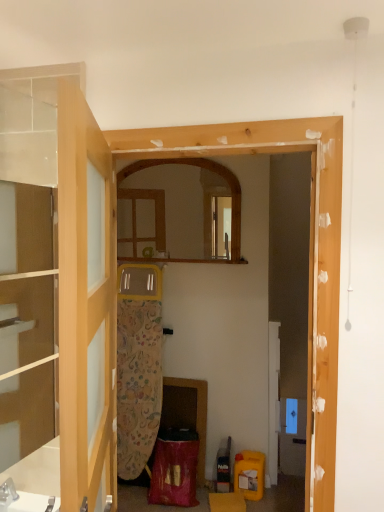
Question: From the image's perspective, is clear glass door at left above transparent glass cabinet at left?

Choices:
 (A) yes
 (B) no

Answer: (B)

Question: Is the position of clear glass door at left less distant than that of transparent glass cabinet at left?

Choices:
 (A) yes
 (B) no

Answer: (A)

Question: Does clear glass door at left come behind transparent glass cabinet at left?

Choices:
 (A) yes
 (B) no

Answer: (B)

Question: Is clear glass door at left positioned far away from transparent glass cabinet at left?

Choices:
 (A) yes
 (B) no

Answer: (B)

Question: Is clear glass door at left at the right side of transparent glass cabinet at left?

Choices:
 (A) no
 (B) yes

Answer: (B)

Question: Would you say clear glass door at left is inside or outside transparent glass cabinet at left?

Choices:
 (A) inside
 (B) outside

Answer: (B)

Question: Considering the positions of clear glass door at left and transparent glass cabinet at left in the image, is clear glass door at left taller or shorter than transparent glass cabinet at left?

Choices:
 (A) tall
 (B) short

Answer: (B)

Question: Relative to transparent glass cabinet at left, is clear glass door at left in front or behind?

Choices:
 (A) front
 (B) behind

Answer: (A)

Question: From a real-world perspective, is clear glass door at left positioned above or below transparent glass cabinet at left?

Choices:
 (A) below
 (B) above

Answer: (A)

Question: Considering the positions of wooden mirror at center and clear glass door at left in the image, is wooden mirror at center bigger or smaller than clear glass door at left?

Choices:
 (A) big
 (B) small

Answer: (B)

Question: Visually, is wooden mirror at center positioned to the left or to the right of clear glass door at left?

Choices:
 (A) left
 (B) right

Answer: (B)

Question: Is wooden mirror at center taller or shorter than clear glass door at left?

Choices:
 (A) tall
 (B) short

Answer: (B)

Question: Relative to clear glass door at left, is wooden mirror at center in front or behind?

Choices:
 (A) behind
 (B) front

Answer: (A)

Question: From a real-world perspective, is wooden mirror at center positioned above or below transparent glass cabinet at left?

Choices:
 (A) above
 (B) below

Answer: (A)

Question: Is point (168, 204) positioned closer to the camera than point (21, 338)?

Choices:
 (A) farther
 (B) closer

Answer: (A)